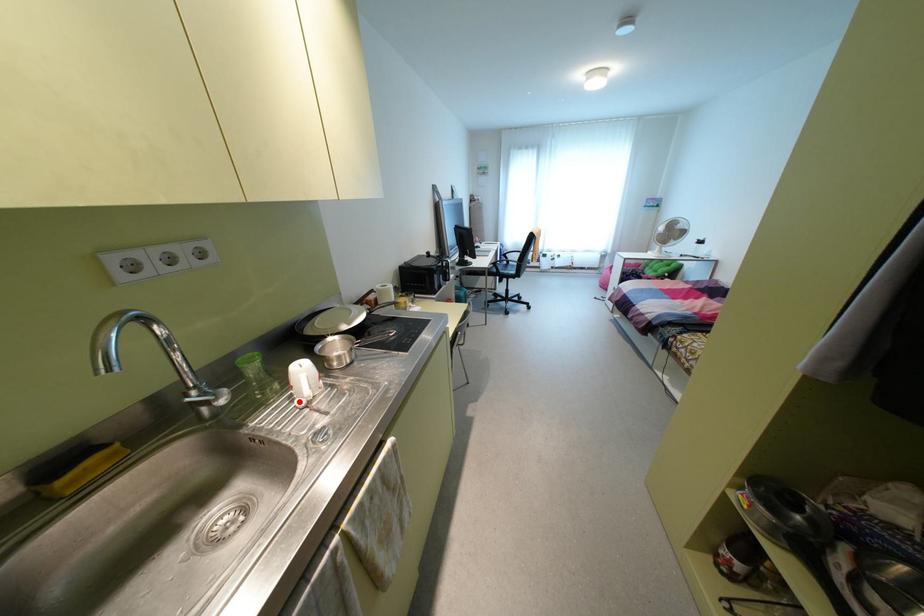
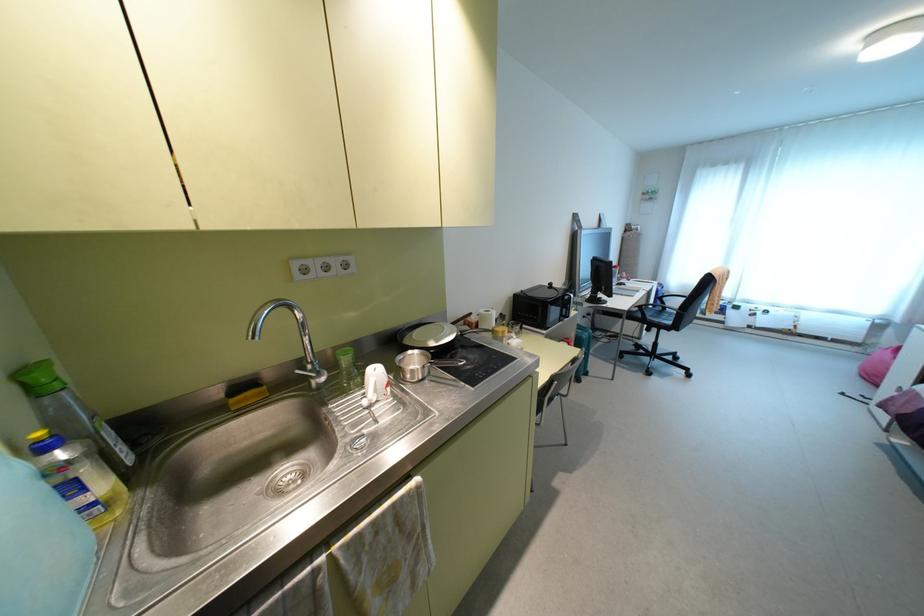
The point at the highlighted location is marked in the first image. Where is the corresponding point in the second image?

(365, 400)